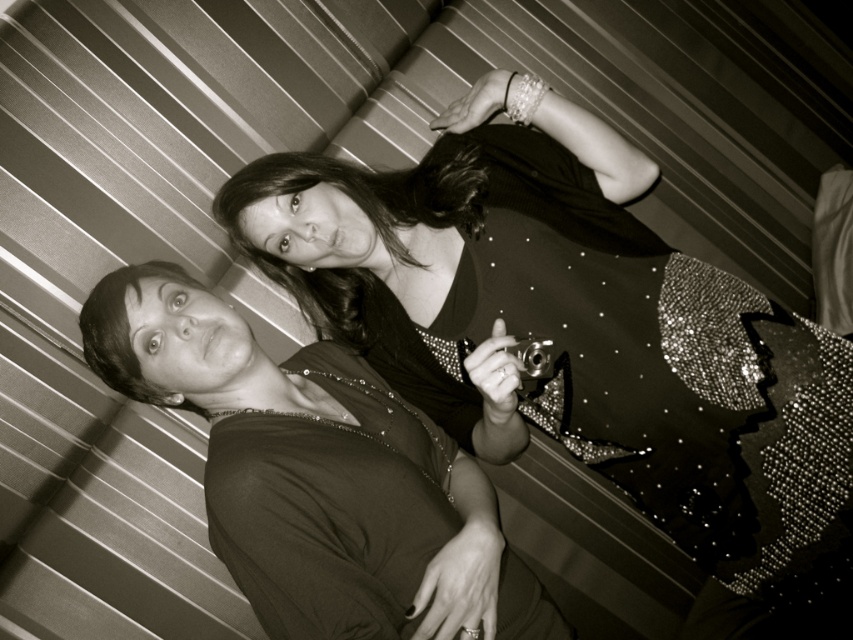
Question: Which point is closer to the camera taking this photo?

Choices:
 (A) (711, 404)
 (B) (469, 618)

Answer: (B)

Question: Is shiny sequined dress at center above matte black dress at center?

Choices:
 (A) no
 (B) yes

Answer: (B)

Question: Which object is farther from the camera taking this photo?

Choices:
 (A) matte black dress at center
 (B) shiny sequined dress at center

Answer: (B)

Question: Among these points, which one is nearest to the camera?

Choices:
 (A) (422, 298)
 (B) (389, 429)

Answer: (B)

Question: In this image, where is shiny sequined dress at center located relative to matte black dress at center?

Choices:
 (A) right
 (B) left

Answer: (A)

Question: Is shiny sequined dress at center in front of matte black dress at center?

Choices:
 (A) yes
 (B) no

Answer: (B)